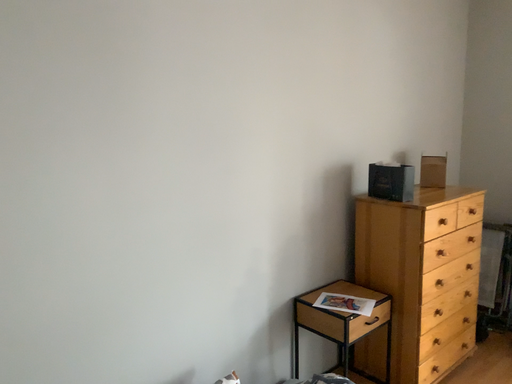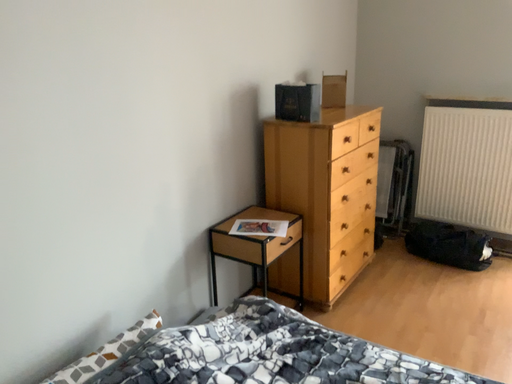
Question: Which way did the camera rotate in the video?

Choices:
 (A) rotated left
 (B) rotated right

Answer: (B)